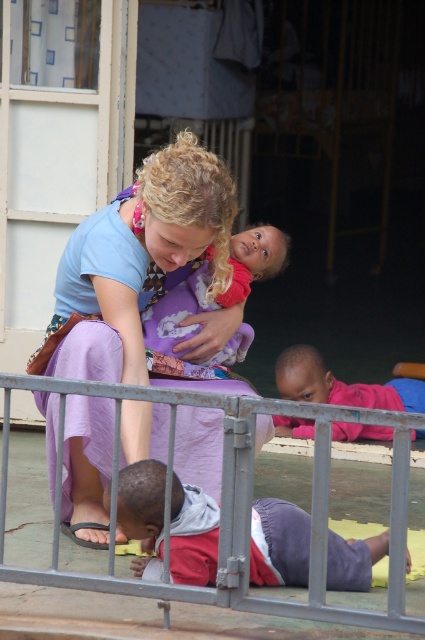
You are a caregiver in the care facility. You need to reach the metallic gray gate at lower center to secure it. However, there is a light purple fabric at center in the way. Can you move the fabric to access the gate?

The metallic gray gate at lower center is positioned under the light purple fabric at center, so you can move the light purple fabric at center to access the gate.

You are a caregiver in the care facility and need to ensure the children can see the baby. Considering the metallic gray gate at lower center and the light purple fabric at center, which object is shorter and might block their view?

The metallic gray gate at lower center is shorter than the light purple fabric at center, so it might block the childrens view.

You are a photographer setting up for a group photo in this scene. You need to place two markers at the coordinates provided. Which marker, point at (223, 620) or point at (183, 372), will be closer to the camera lens?

Point at (223, 620) is closer to the viewer than point at (183, 372), so the marker placed at point at (223, 620) will be closer to the camera lens.